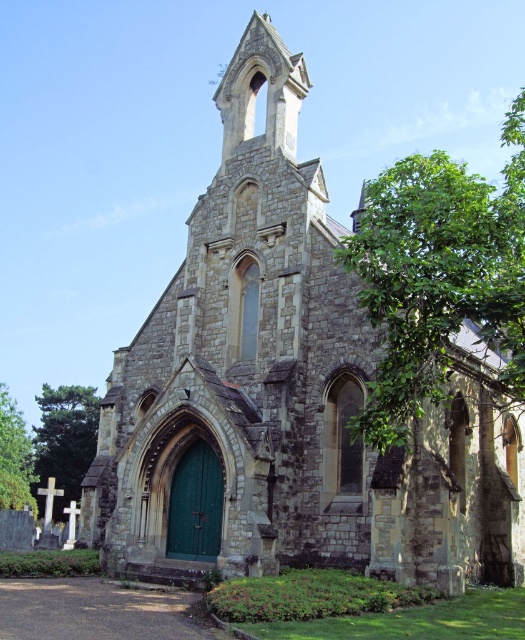
Which is below, green leafy tree at right or green leafy tree at lower left?

Positioned lower is green leafy tree at lower left.

Is green leafy tree at right bigger than green leafy tree at lower left?

Yes, green leafy tree at right is bigger than green leafy tree at lower left.

Where is `green leafy tree at right`? green leafy tree at right is located at coordinates (439, 280).

Image resolution: width=525 pixels, height=640 pixels. In order to click on green leafy tree at right in this screenshot , I will do `click(439, 280)`.

Between green leafy tree at left and green leafy tree at lower left, which one is positioned higher?

green leafy tree at left

Is green leafy tree at left bigger than green leafy tree at lower left?

Actually, green leafy tree at left might be smaller than green leafy tree at lower left.

Image resolution: width=525 pixels, height=640 pixels. What do you see at coordinates (65, 440) in the screenshot?
I see `green leafy tree at left` at bounding box center [65, 440].

You are a GUI agent. You are given a task and a screenshot of the screen. Output one action in this format:
    pyautogui.click(x=<x>, y=<y>)
    Task: Click on the green leafy tree at left
    
    Given the screenshot: What is the action you would take?
    pyautogui.click(x=65, y=440)

From the picture: Is green leafy tree at right thinner than green leafy tree at left?

In fact, green leafy tree at right might be wider than green leafy tree at left.

Is green leafy tree at right to the right of green leafy tree at left from the viewer's perspective?

Yes, green leafy tree at right is to the right of green leafy tree at left.

The image size is (525, 640). Identify the location of green leafy tree at right. (439, 280).